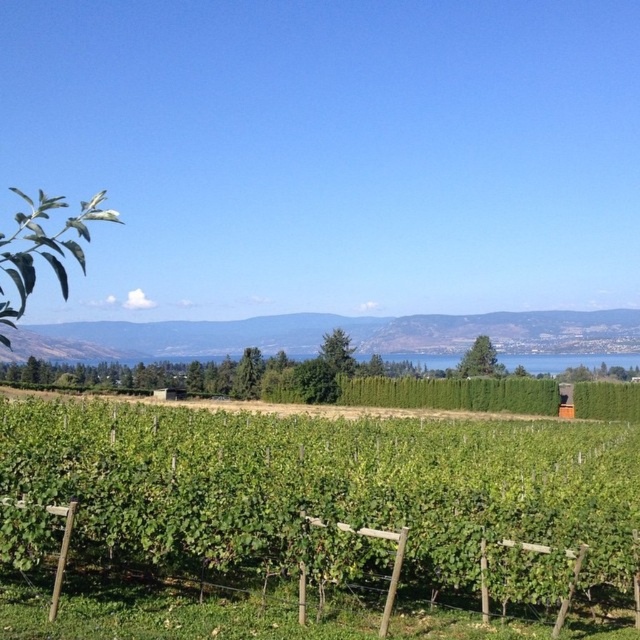
Question: Which of the following is the closest to the observer?

Choices:
 (A) (576, 385)
 (B) (516, 404)
 (C) (540, 320)
 (D) (520, 355)

Answer: (A)

Question: Which point is closer to the camera?

Choices:
 (A) green leafy hedge at center
 (B) green leafy hedge at right
 (C) green leafy vines at center

Answer: (C)

Question: Can you confirm if green leafy hillside at center is positioned to the right of green leafy hedge at center?

Choices:
 (A) no
 (B) yes

Answer: (A)

Question: Can you confirm if green leafy vines at center is smaller than green hedge at center?

Choices:
 (A) yes
 (B) no

Answer: (B)

Question: Which object is positioned farthest from the green leafy hillside at center?

Choices:
 (A) green leafy vines at center
 (B) green leafy hedge at right
 (C) green hedge at center

Answer: (A)

Question: Does green leafy vines at center have a greater width compared to green hedge at center?

Choices:
 (A) no
 (B) yes

Answer: (A)